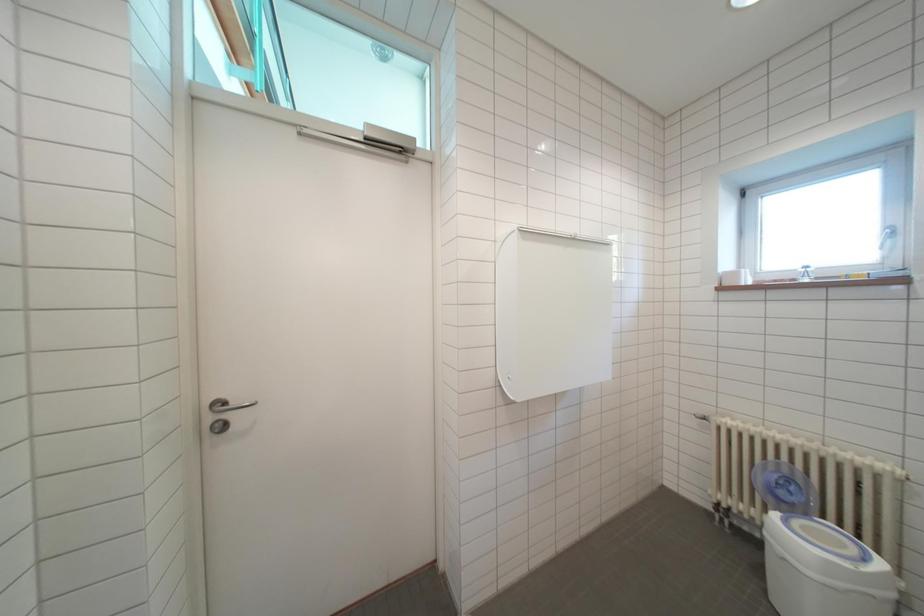
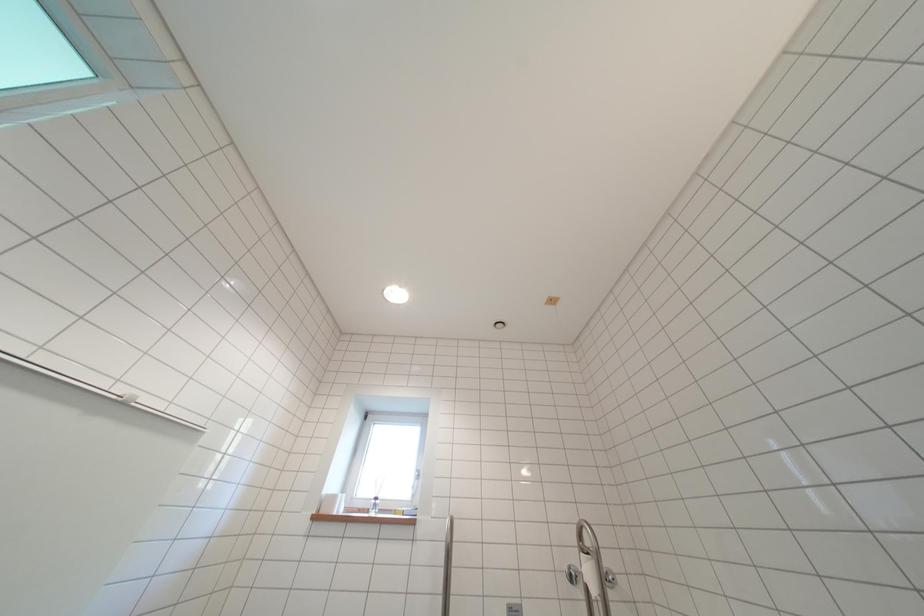
How did the camera likely rotate?

The rotation direction of the camera is right-up.